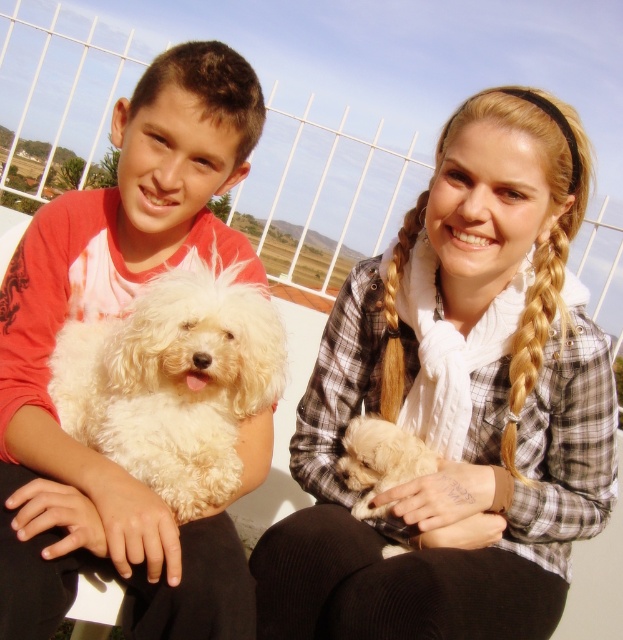
Does blonde braided hair at upper right have a greater height compared to golden braided hair at upper right?

Yes.

What do you see at coordinates (535, 330) in the screenshot? The image size is (623, 640). I see `blonde braided hair at upper right` at bounding box center [535, 330].

Locate an element on the screen. This screenshot has height=640, width=623. blonde braided hair at upper right is located at coordinates (535, 330).

Does plaid shirt at center lie behind golden braided hair at upper right?

No, it is not.

Does plaid shirt at center appear on the left side of golden braided hair at upper right?

No, plaid shirt at center is not to the left of golden braided hair at upper right.

What do you see at coordinates (459, 401) in the screenshot? I see `plaid shirt at center` at bounding box center [459, 401].

At what (x,y) coordinates should I click in order to perform the action: click on plaid shirt at center. Please return your answer as a coordinate pair (x, y). Looking at the image, I should click on (459, 401).

The image size is (623, 640). What do you see at coordinates (105, 316) in the screenshot? I see `fluffy white dog at left` at bounding box center [105, 316].

Does fluffy white dog at left come in front of golden braided hair at upper right?

Yes, fluffy white dog at left is in front of golden braided hair at upper right.

From the picture: Who is more forward, [221,179] or [396,280]?

Point [221,179] is more forward.

Where is `fluffy white dog at left`? This screenshot has height=640, width=623. fluffy white dog at left is located at coordinates (105, 316).